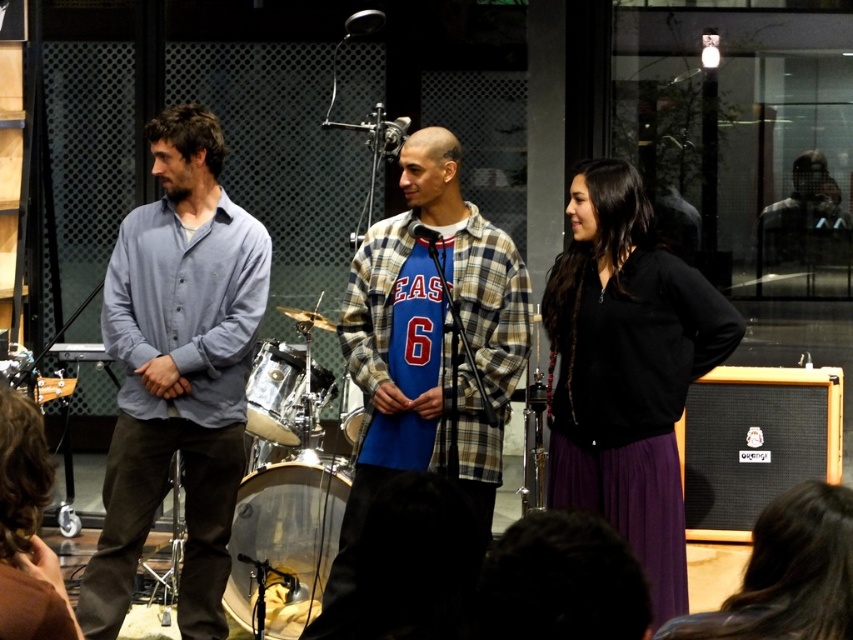
Question: Which point is closer to the camera?

Choices:
 (A) (566, 376)
 (B) (234, 316)
 (C) (21, 605)

Answer: (C)

Question: Does blue plaid shirt at center appear on the left side of black matte sweatshirt at center?

Choices:
 (A) yes
 (B) no

Answer: (A)

Question: Among these points, which one is farthest from the camera?

Choices:
 (A) (776, 541)
 (B) (279, 420)
 (C) (67, 609)

Answer: (B)

Question: Can you confirm if shiny silver drum at center is bigger than matte silver drum at center?

Choices:
 (A) yes
 (B) no

Answer: (A)

Question: Observing the image, what is the correct spatial positioning of matte blue shirt at center in reference to black matte sweatshirt at center?

Choices:
 (A) left
 (B) right

Answer: (A)

Question: Which object appears farthest from the camera in this image?

Choices:
 (A) clear plastic drum at center
 (B) shiny silver drum at center

Answer: (A)